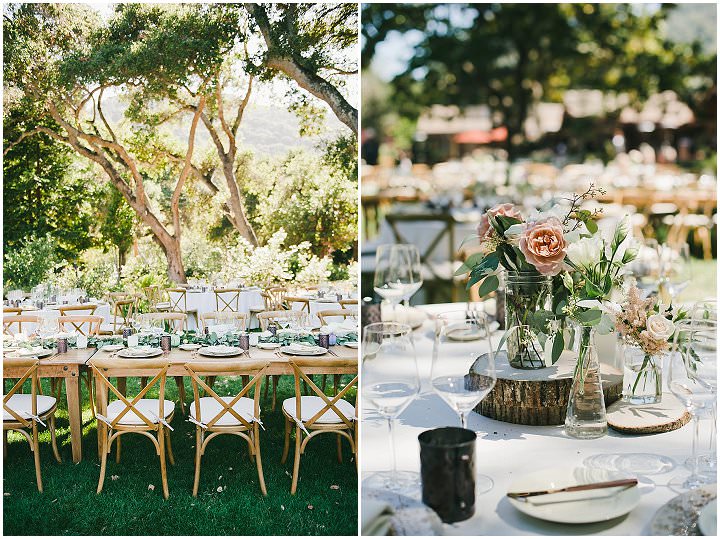
The height and width of the screenshot is (539, 720). I want to click on water in vase, so click(x=589, y=393).